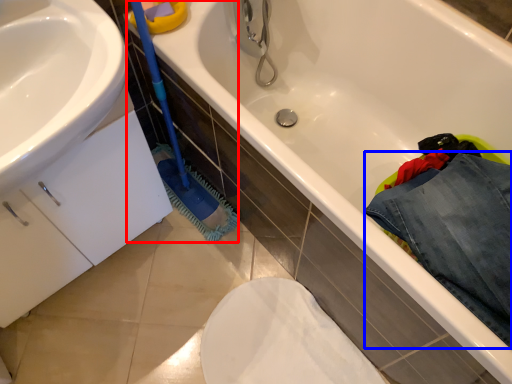
Question: Which object is further to the camera taking this photo, brush (highlighted by a red box) or clothing (highlighted by a blue box)?

Choices:
 (A) brush
 (B) clothing

Answer: (B)